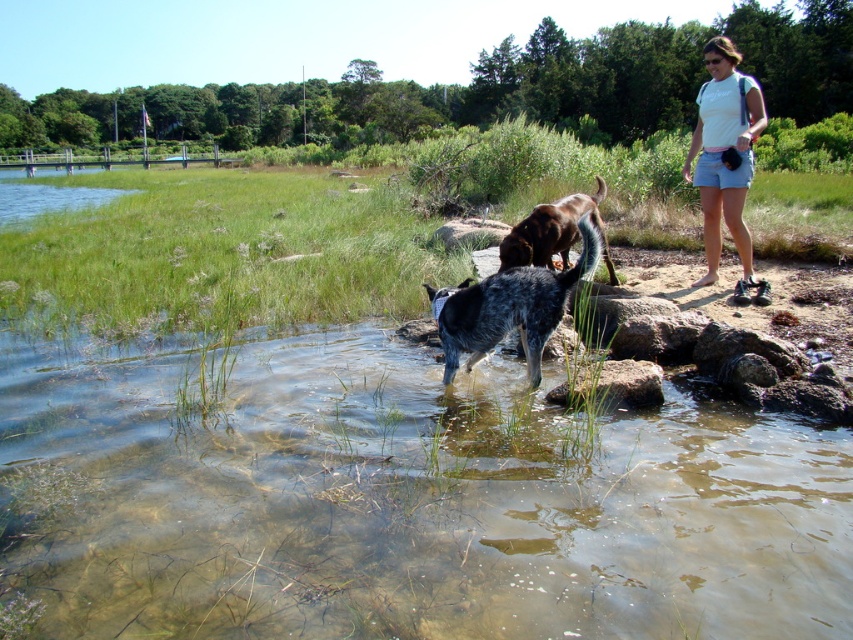
Is white cotton shirt at upper right above blue speckled fur at center?

Yes.

Where is `white cotton shirt at upper right`? This screenshot has width=853, height=640. white cotton shirt at upper right is located at coordinates (724, 152).

Is blue speckled fur at center above smooth gray rock at lower center?

→ Yes.

Does blue speckled fur at center have a lesser height compared to smooth gray rock at lower center?

In fact, blue speckled fur at center may be taller than smooth gray rock at lower center.

I want to click on blue speckled fur at center, so click(x=512, y=308).

Locate an element on the screen. blue speckled fur at center is located at coordinates (512, 308).

Who is taller, white cotton shirt at upper right or smooth gray rock at lower center?

white cotton shirt at upper right is taller.

I want to click on white cotton shirt at upper right, so click(724, 152).